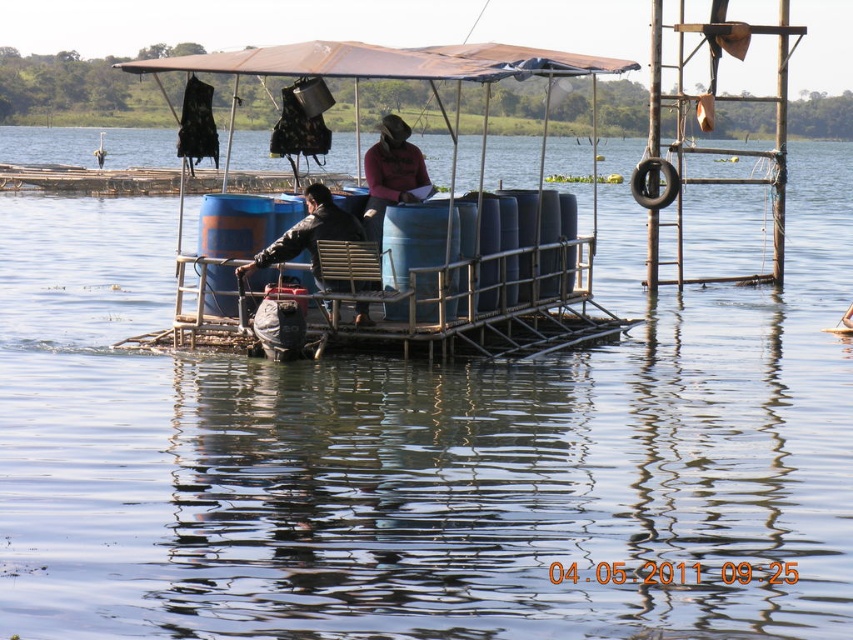
Between blue plastic barrels at center and matte pink shirt at center, which one is positioned lower?

matte pink shirt at center

Where is `blue plastic barrels at center`? The width and height of the screenshot is (853, 640). blue plastic barrels at center is located at coordinates (445, 211).

The width and height of the screenshot is (853, 640). Find the location of `blue plastic barrels at center`. blue plastic barrels at center is located at coordinates (445, 211).

Which is behind, point (543, 216) or point (349, 221)?

Positioned behind is point (543, 216).

Between point (181, 308) and point (309, 209), which one is positioned in front?

Point (309, 209) is in front.

Where is `blue plastic barrels at center`? This screenshot has height=640, width=853. blue plastic barrels at center is located at coordinates (445, 211).

Between leather jacket at center and matte pink shirt at center, which one appears on the left side from the viewer's perspective?

Positioned to the left is leather jacket at center.

Find the location of a particular element. This screenshot has width=853, height=640. leather jacket at center is located at coordinates (310, 236).